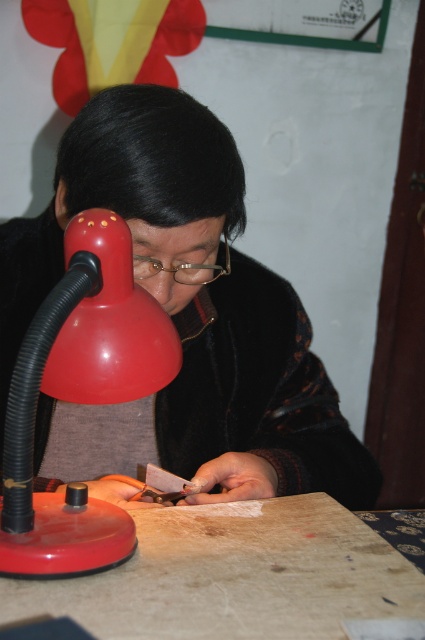
You are a photographer setting up a shot of the scene. The matte black jacket at center is crucial for the composition. Where exactly should you place the jacket in the frame to maintain the existing arrangement?

The matte black jacket at center should be placed at the 2D coordinates point (183, 317) to maintain the existing arrangement.

You are trying to reach for the metallic silver tool at center while avoiding the matte plastic desk lamp at left. Can you lift the tool without touching the lamp?

The matte plastic desk lamp at left is above the metallic silver tool at center, so you can lift the tool without touching the lamp by moving it vertically upwards first.

You are organizing a craft workshop and need to ensure that participants can easily access both the matte plastic desk lamp at left and the metallic silver tool at center. Considering their sizes, which item should be placed closer to the edge of the table to save space?

The metallic silver tool at center should be placed closer to the edge of the table because it is smaller in size compared to the matte plastic desk lamp at left, allowing for better space conservation.